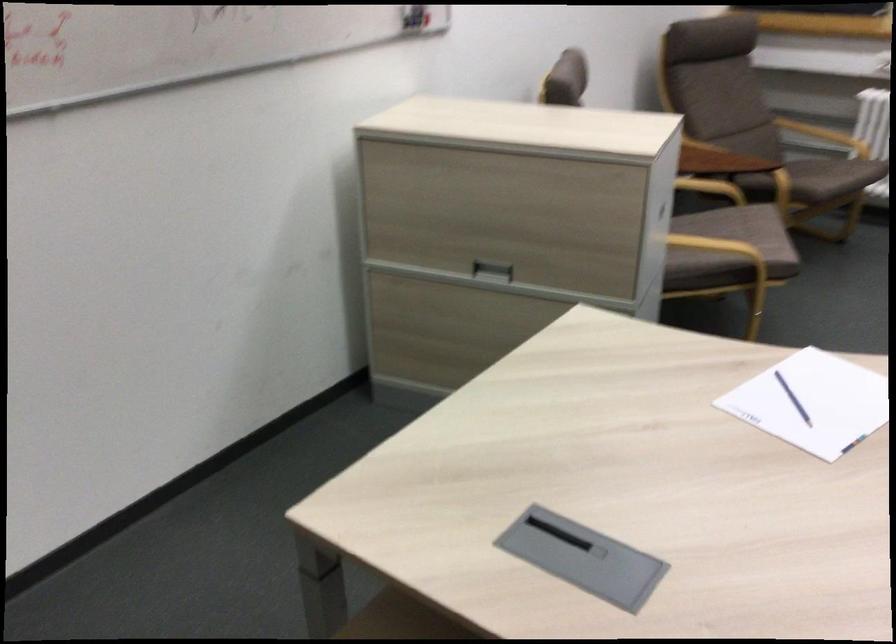
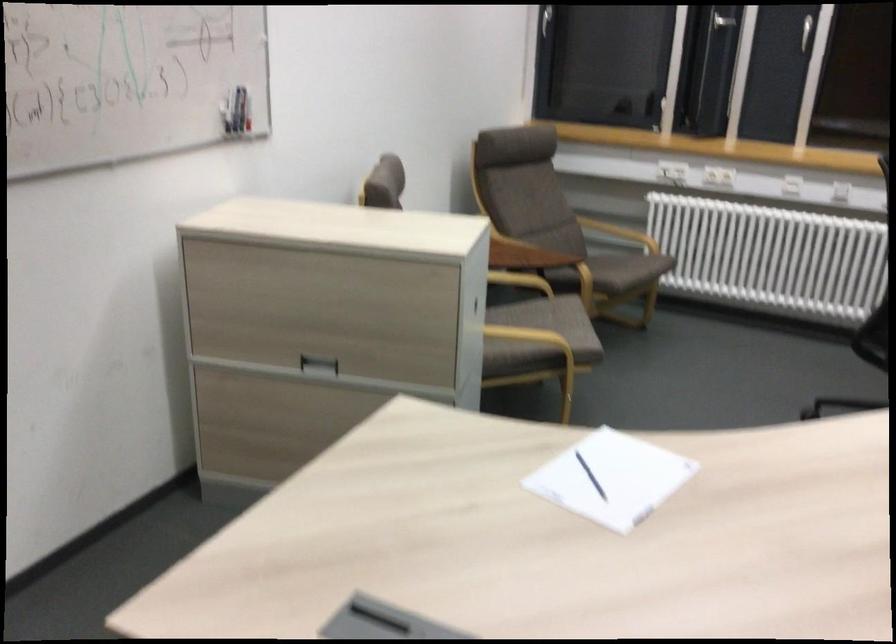
In the second image, find the point that corresponds to the point at 717,247 in the first image.

(528, 336)